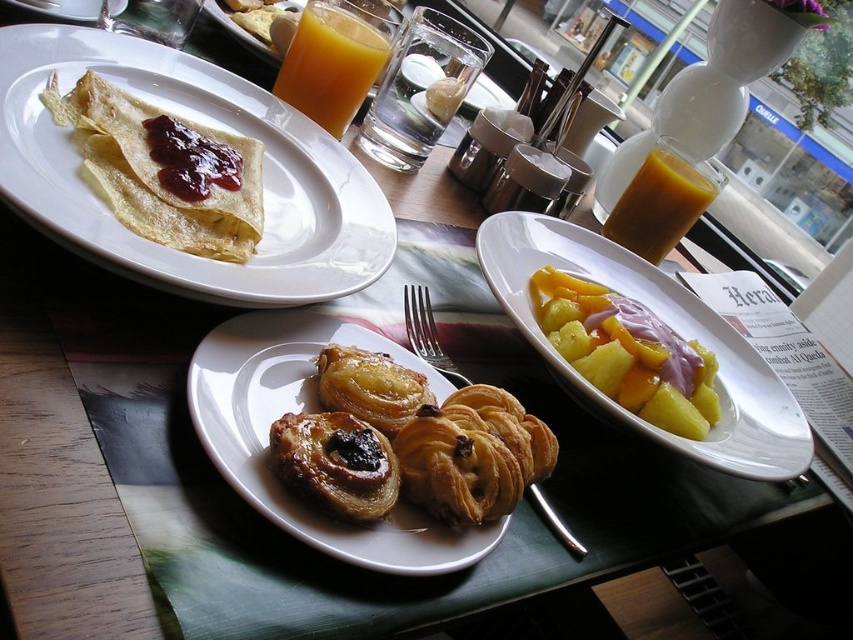
Locate an element on the screen. This screenshot has width=853, height=640. yellow pineapple at center is located at coordinates (627, 353).

What are the coordinates of `yellow pineapple at center` in the screenshot? It's located at (627, 353).

Identify the location of yellow pineapple at center. (627, 353).

How much distance is there between glazed golden-brown pastry at center and golden flaky pastry at center?

glazed golden-brown pastry at center is 1.44 inches from golden flaky pastry at center.

Which is below, glazed golden-brown pastry at center or golden flaky pastry at center?

glazed golden-brown pastry at center is lower down.

Find the location of `glazed golden-brown pastry at center`. glazed golden-brown pastry at center is located at coordinates (335, 464).

Can you confirm if matte crepe at upper left is positioned below golden flaky pastry at center?

Incorrect, matte crepe at upper left is not positioned below golden flaky pastry at center.

Consider the image. Is matte crepe at upper left taller than golden flaky pastry at center?

Yes.

Which is behind, point (0, 189) or point (404, 422)?

The point (404, 422) is more distant.

Locate an element on the screen. The width and height of the screenshot is (853, 640). matte crepe at upper left is located at coordinates (204, 124).